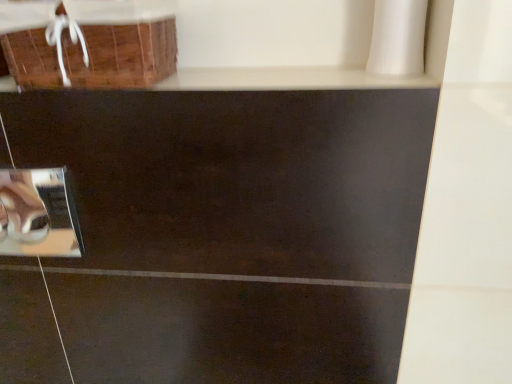
Question: Considering the positions of metallic silver mirror at lower left and brown woven basket at upper left in the image, is metallic silver mirror at lower left taller or shorter than brown woven basket at upper left?

Choices:
 (A) short
 (B) tall

Answer: (B)

Question: Considering the positions of metallic silver mirror at lower left and brown woven basket at upper left in the image, is metallic silver mirror at lower left bigger or smaller than brown woven basket at upper left?

Choices:
 (A) small
 (B) big

Answer: (A)

Question: Considering the positions of metallic silver mirror at lower left and brown woven basket at upper left in the image, is metallic silver mirror at lower left wider or thinner than brown woven basket at upper left?

Choices:
 (A) wide
 (B) thin

Answer: (B)

Question: Does point (118, 84) appear closer or farther from the camera than point (11, 200)?

Choices:
 (A) closer
 (B) farther

Answer: (A)

Question: From a real-world perspective, is brown woven basket at upper left above or below metallic silver mirror at lower left?

Choices:
 (A) above
 (B) below

Answer: (A)

Question: Visually, is brown woven basket at upper left positioned to the left or to the right of metallic silver mirror at lower left?

Choices:
 (A) left
 (B) right

Answer: (B)

Question: Considering the positions of brown woven basket at upper left and metallic silver mirror at lower left in the image, is brown woven basket at upper left bigger or smaller than metallic silver mirror at lower left?

Choices:
 (A) big
 (B) small

Answer: (A)